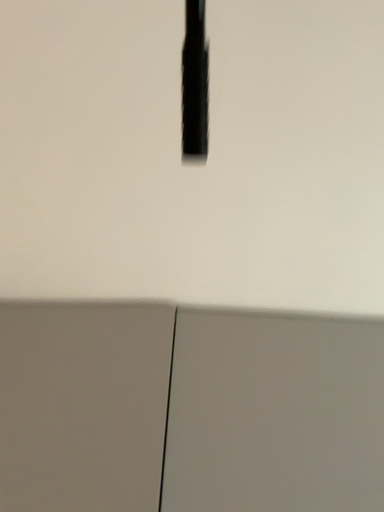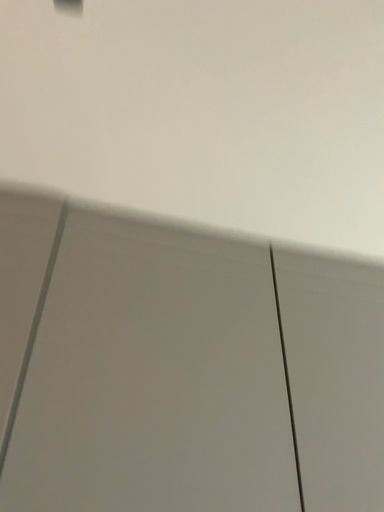
Question: How did the camera likely rotate when shooting the video?

Choices:
 (A) rotated left
 (B) rotated right

Answer: (B)